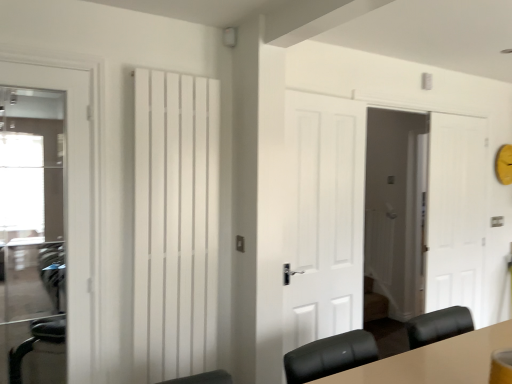
What do you see at coordinates (323, 217) in the screenshot? The height and width of the screenshot is (384, 512). I see `white matte door at center, arranged as the second door when viewed from the left` at bounding box center [323, 217].

Identify the location of white glossy door at left, marked as the first door in a left-to-right arrangement. Image resolution: width=512 pixels, height=384 pixels. (72, 188).

This screenshot has height=384, width=512. What are the coordinates of `white matte door at right, marked as the fourth door in a left-to-right arrangement` in the screenshot? It's located at (456, 213).

I want to click on white matte radiator at center, so click(175, 225).

In terms of height, does white matte door at center, which ranks as the second door in front-to-back order, look taller or shorter compared to white matte door at center, which ranks as the second door in right-to-left order?

white matte door at center, which ranks as the second door in front-to-back order, is shorter than white matte door at center, which ranks as the second door in right-to-left order.

From the image's perspective, which one is positioned lower, white matte door at center, which ranks as the second door in front-to-back order, or white matte door at center, the third door from the left?

From the image's view, white matte door at center, the third door from the left, is below.

Considering the relative sizes of white matte door at center, positioned as the 3th door in right-to-left order, and white matte door at center, which ranks as the second door in right-to-left order, in the image provided, is white matte door at center, positioned as the 3th door in right-to-left order, bigger than white matte door at center, which ranks as the second door in right-to-left order,?

No.

From a real-world perspective, does white matte door at center, arranged as the second door when viewed from the left, stand above white matte door at center, which is counted as the 2th door, starting from the back?

Indeed, from a real-world perspective, white matte door at center, arranged as the second door when viewed from the left, stands above white matte door at center, which is counted as the 2th door, starting from the back.

In terms of height, does white matte door at right, positioned as the 1th door in back-to-front order, look taller or shorter compared to white glossy door at left, marked as the first door in a left-to-right arrangement?

white matte door at right, positioned as the 1th door in back-to-front order, is taller than white glossy door at left, marked as the first door in a left-to-right arrangement.

Looking at this image, is white matte door at right, placed as the 4th door when sorted from front to back, at the right side of white glossy door at left, which ranks as the first door in front-to-back order?

Indeed, white matte door at right, placed as the 4th door when sorted from front to back, is positioned on the right side of white glossy door at left, which ranks as the first door in front-to-back order.

There is a white matte door at right, placed as the 4th door when sorted from front to back. At what (x,y) coordinates should I click in order to perform the action: click on the 2nd door above it (from the image's perspective). Please return your answer as a coordinate pair (x, y). Image resolution: width=512 pixels, height=384 pixels. Looking at the image, I should click on (72, 188).

From a real-world perspective, who is located higher, white matte door at right, placed as the 4th door when sorted from front to back, or white glossy door at left, marked as the first door in a left-to-right arrangement?

white glossy door at left, marked as the first door in a left-to-right arrangement, from a real-world perspective.

Which object is thinner, white matte door at center, positioned as the 3th door in back-to-front order, or white matte door at right, marked as the fourth door in a left-to-right arrangement?

With smaller width is white matte door at right, marked as the fourth door in a left-to-right arrangement.

From the image's perspective, between white matte door at center, which ranks as the second door in front-to-back order, and white matte door at right, positioned as the 1th door in back-to-front order, who is located below?

white matte door at right, positioned as the 1th door in back-to-front order, is shown below in the image.

Based on the photo, is white matte door at center, positioned as the 3th door in back-to-front order, bigger or smaller than white matte door at right, placed as the 4th door when sorted from front to back?

Considering their sizes, white matte door at center, positioned as the 3th door in back-to-front order, takes up more space than white matte door at right, placed as the 4th door when sorted from front to back.

Considering their positions, is white matte radiator at center located in front of or behind white matte door at center, positioned as the 3th door in back-to-front order?

Visually, white matte radiator at center is located in front of white matte door at center, positioned as the 3th door in back-to-front order.

Is white matte radiator at center taller or shorter than white matte door at center, arranged as the second door when viewed from the left?

In the image, white matte radiator at center appears to be taller than white matte door at center, arranged as the second door when viewed from the left.

In the scene shown: Is white matte radiator at center oriented towards white matte door at center, positioned as the 3th door in right-to-left order?

No.

What's the angular difference between white matte radiator at center and white matte door at center, positioned as the 3th door in right-to-left order,'s facing directions?

The facing directions of white matte radiator at center and white matte door at center, positioned as the 3th door in right-to-left order, are 4.92 degrees apart.

Is white glossy door at left, which is counted as the fourth door, starting from the right, next to white matte door at center, positioned as the 3th door in back-to-front order?

No, white glossy door at left, which is counted as the fourth door, starting from the right, is not beside white matte door at center, positioned as the 3th door in back-to-front order.

Considering the positions of point (93, 223) and point (351, 126), is point (93, 223) closer or farther from the camera than point (351, 126)?

Point (93, 223) appears to be closer to the viewer than point (351, 126).

From a real-world perspective, is white glossy door at left, which ranks as the first door in front-to-back order, physically below white matte door at center, which ranks as the second door in front-to-back order?

Yes, from a real-world perspective, white glossy door at left, which ranks as the first door in front-to-back order, is under white matte door at center, which ranks as the second door in front-to-back order.

Are white glossy door at left, which is counted as the fourth door, starting from the right, and white matte door at center, which ranks as the second door in right-to-left order, located far from each other?

white glossy door at left, which is counted as the fourth door, starting from the right, is far away from white matte door at center, which ranks as the second door in right-to-left order.

From the image's perspective, which object appears higher, white glossy door at left, the 4th door from the back, or white matte door at center, which is counted as the 3th door, starting from the front?

white glossy door at left, the 4th door from the back, from the image's perspective.

Is white glossy door at left, marked as the first door in a left-to-right arrangement, in front of or behind white matte door at center, the third door from the left, in the image?

white glossy door at left, marked as the first door in a left-to-right arrangement, is in front of white matte door at center, the third door from the left.

Considering the sizes of objects white glossy door at left, marked as the first door in a left-to-right arrangement, and white matte door at center, which is counted as the 3th door, starting from the front, in the image provided, who is smaller, white glossy door at left, marked as the first door in a left-to-right arrangement, or white matte door at center, which is counted as the 3th door, starting from the front,?

With smaller size is white glossy door at left, marked as the first door in a left-to-right arrangement.

Could you tell me if white matte door at right, placed as the 4th door when sorted from front to back, is facing white matte radiator at center?

No, white matte door at right, placed as the 4th door when sorted from front to back, is not aimed at white matte radiator at center.

From a real-world perspective, who is located higher, white matte door at right, the 1th door viewed from the right, or white matte radiator at center?

white matte radiator at center, from a real-world perspective.

Is white matte door at right, the 1th door viewed from the right, beside white matte radiator at center?

No, white matte door at right, the 1th door viewed from the right, is not next to white matte radiator at center.

Would you say white matte radiator at center is part of white matte door at right, positioned as the 1th door in back-to-front order,'s contents?

That's incorrect, white matte radiator at center is not inside white matte door at right, positioned as the 1th door in back-to-front order.

From a real-world perspective, which door is the 2nd one underneath the white matte door at center, arranged as the second door when viewed from the left? Please provide its 2D coordinates.

[(380, 213)]

Where is `the 2nd door below the white glossy door at left, the 4th door from the back (from the image's perspective)`? This screenshot has width=512, height=384. the 2nd door below the white glossy door at left, the 4th door from the back (from the image's perspective) is located at coordinates (456, 213).

Based on their spatial positions, is white matte door at center, positioned as the 3th door in back-to-front order, or white glossy door at left, which is counted as the fourth door, starting from the right, closer to white matte radiator at center?

white glossy door at left, which is counted as the fourth door, starting from the right, is positioned closer to the anchor white matte radiator at center.

Looking at this image, looking at the image, which one is located closer to white glossy door at left, marked as the first door in a left-to-right arrangement, white matte door at right, marked as the fourth door in a left-to-right arrangement, or white matte door at center, positioned as the 3th door in back-to-front order?

white matte door at center, positioned as the 3th door in back-to-front order, lies closer to white glossy door at left, marked as the first door in a left-to-right arrangement, than the other object.

Considering their positions, is white matte door at right, marked as the fourth door in a left-to-right arrangement, positioned closer to white matte door at center, positioned as the 3th door in back-to-front order, than white glossy door at left, which is counted as the fourth door, starting from the right?

white matte door at right, marked as the fourth door in a left-to-right arrangement.

From the image, which object appears to be nearer to white matte radiator at center, white glossy door at left, marked as the first door in a left-to-right arrangement, or white matte door at right, marked as the fourth door in a left-to-right arrangement?

Among the two, white glossy door at left, marked as the first door in a left-to-right arrangement, is located nearer to white matte radiator at center.

Based on their spatial positions, is white matte door at center, which is counted as the 3th door, starting from the front, or white matte door at right, placed as the 4th door when sorted from front to back, further from white glossy door at left, marked as the first door in a left-to-right arrangement?

white matte door at center, which is counted as the 3th door, starting from the front, is further to white glossy door at left, marked as the first door in a left-to-right arrangement.

When comparing their distances from white matte door at center, which is counted as the 3th door, starting from the front, does white glossy door at left, which is counted as the fourth door, starting from the right, or white matte door at center, positioned as the 3th door in right-to-left order, seem closer?

white matte door at center, positioned as the 3th door in right-to-left order, is positioned closer to the anchor white matte door at center, which is counted as the 3th door, starting from the front.

Based on their spatial positions, is white matte radiator at center or white matte door at center, which ranks as the second door in right-to-left order, further from white matte door at right, positioned as the 1th door in back-to-front order?

Based on the image, white matte radiator at center appears to be further to white matte door at right, positioned as the 1th door in back-to-front order.

Looking at the image, which one is located further to white matte door at center, positioned as the 3th door in back-to-front order, white glossy door at left, which ranks as the first door in front-to-back order, or white matte door at center, which is counted as the 3th door, starting from the front?

Based on the image, white matte door at center, which is counted as the 3th door, starting from the front, appears to be further to white matte door at center, positioned as the 3th door in back-to-front order.

Locate an element on the screen. This screenshot has width=512, height=384. curtain between white glossy door at left, marked as the first door in a left-to-right arrangement, and white matte door at center, positioned as the 3th door in back-to-front order is located at coordinates (175, 225).

This screenshot has width=512, height=384. I want to click on door between white glossy door at left, the 4th door from the back, and white matte door at center, which is counted as the 2th door, starting from the back, in the horizontal direction, so click(323, 217).

Identify the location of curtain located between white glossy door at left, which ranks as the first door in front-to-back order, and white matte door at right, the 1th door viewed from the right, in the left-right direction. (175, 225).

This screenshot has width=512, height=384. Find the location of `curtain between white glossy door at left, which is counted as the fourth door, starting from the right, and white matte door at center, which is counted as the 3th door, starting from the front`. curtain between white glossy door at left, which is counted as the fourth door, starting from the right, and white matte door at center, which is counted as the 3th door, starting from the front is located at coordinates (175, 225).